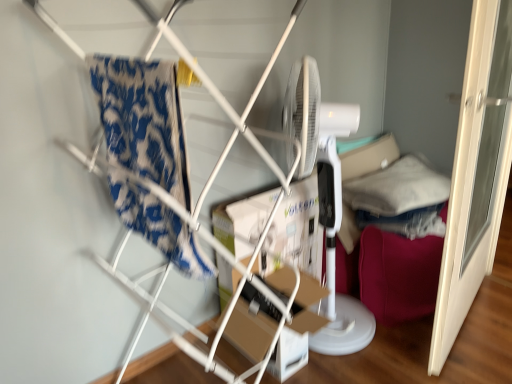
Describe the element at coordinates (143, 119) in the screenshot. I see `blue patterned fabric at left` at that location.

Image resolution: width=512 pixels, height=384 pixels. What do you see at coordinates (326, 197) in the screenshot? I see `white plastic mechanical fan at right` at bounding box center [326, 197].

The height and width of the screenshot is (384, 512). What do you see at coordinates (397, 274) in the screenshot? I see `velvet pink bean bag chair at right` at bounding box center [397, 274].

This screenshot has height=384, width=512. What do you see at coordinates (397, 188) in the screenshot?
I see `soft white pillow at right` at bounding box center [397, 188].

At what (x,y) coordinates should I click in order to perform the action: click on cardboard box at center. Please return your answer as a coordinate pair (x, y). Image resolution: width=512 pixels, height=384 pixels. Looking at the image, I should click on (295, 319).

Can you confirm if soft white pillow at right is wider than blue patterned fabric at left?

In fact, soft white pillow at right might be narrower than blue patterned fabric at left.

Is soft white pillow at right bigger than blue patterned fabric at left?

Yes.

Measure the distance between soft white pillow at right and blue patterned fabric at left.

A distance of 3.87 feet exists between soft white pillow at right and blue patterned fabric at left.

Is soft white pillow at right facing towards blue patterned fabric at left?

No, soft white pillow at right does not turn towards blue patterned fabric at left.

Can you tell me how much velvet pink bean bag chair at right and white plastic mechanical fan at right differ in facing direction?

The angle between the facing direction of velvet pink bean bag chair at right and the facing direction of white plastic mechanical fan at right is 37.1 degrees.

Which object is closer to the camera, velvet pink bean bag chair at right or white plastic mechanical fan at right?

white plastic mechanical fan at right is closer to the camera.

From the image's perspective, would you say velvet pink bean bag chair at right is shown under white plastic mechanical fan at right?

Correct, velvet pink bean bag chair at right appears lower than white plastic mechanical fan at right in the image.

Considering the sizes of objects velvet pink bean bag chair at right and white plastic mechanical fan at right in the image provided, who is smaller, velvet pink bean bag chair at right or white plastic mechanical fan at right?

Smaller between the two is velvet pink bean bag chair at right.

From the image's perspective, is blue patterned fabric at left below white plastic mechanical fan at right?

No.

Between blue patterned fabric at left and white plastic mechanical fan at right, which one has less height?

blue patterned fabric at left is shorter.

Which object is thinner, blue patterned fabric at left or white plastic mechanical fan at right?

Thinner between the two is white plastic mechanical fan at right.

From a real-world perspective, is blue patterned fabric at left positioned above or below white plastic mechanical fan at right?

From a real-world perspective, blue patterned fabric at left is physically above white plastic mechanical fan at right.

From the image's perspective, relative to cardboard box at center, is white plastic mechanical fan at right above or below?

white plastic mechanical fan at right is above cardboard box at center.

From a real-world perspective, is white plastic mechanical fan at right physically below cardboard box at center?

No.

Looking at this image, does white plastic mechanical fan at right touch cardboard box at center?

No, white plastic mechanical fan at right is not touching cardboard box at center.

Considering the sizes of objects white plastic mechanical fan at right and cardboard box at center in the image provided, who is wider, white plastic mechanical fan at right or cardboard box at center?

white plastic mechanical fan at right is wider.

In terms of height, does velvet pink bean bag chair at right look taller or shorter compared to blue patterned fabric at left?

In the image, velvet pink bean bag chair at right appears to be shorter than blue patterned fabric at left.

From the image's perspective, between velvet pink bean bag chair at right and blue patterned fabric at left, who is located below?

velvet pink bean bag chair at right is shown below in the image.

Are velvet pink bean bag chair at right and blue patterned fabric at left beside each other?

velvet pink bean bag chair at right and blue patterned fabric at left are not in contact.

Is soft white pillow at right at the back of white plastic mechanical fan at right?

No.

From a real-world perspective, which is physically below, white plastic mechanical fan at right or soft white pillow at right?

soft white pillow at right.

In the image, is white plastic mechanical fan at right on the left side or the right side of soft white pillow at right?

Clearly, white plastic mechanical fan at right is on the left of soft white pillow at right in the image.

Measure the distance between white plastic mechanical fan at right and soft white pillow at right.

They are 17.99 inches apart.

From a real-world perspective, is soft white pillow at right under cardboard box at center?

Actually, soft white pillow at right is physically above cardboard box at center in the real world.

Identify the location of pillow on the right side of cardboard box at center. The width and height of the screenshot is (512, 384). (397, 188).

Considering the positions of objects soft white pillow at right and cardboard box at center in the image provided, who is more to the left, soft white pillow at right or cardboard box at center?

Positioned to the left is cardboard box at center.

Between soft white pillow at right and cardboard box at center, which one has smaller width?

With smaller width is cardboard box at center.

Find the location of a particular element. beach towel in front of the soft white pillow at right is located at coordinates (143, 119).

Identify the location of mechanical fan above the velvet pink bean bag chair at right (from the image's perspective). Image resolution: width=512 pixels, height=384 pixels. (326, 197).

Which object lies nearer to the anchor point soft white pillow at right, white plastic mechanical fan at right or blue patterned fabric at left?

white plastic mechanical fan at right is positioned closer to the anchor soft white pillow at right.

Estimate the real-world distances between objects in this image. Which object is closer to velvet pink bean bag chair at right, blue patterned fabric at left or white plastic mechanical fan at right?

The object closer to velvet pink bean bag chair at right is white plastic mechanical fan at right.

Consider the image. Looking at the image, which one is located further to cardboard box at center, blue patterned fabric at left or white plastic mechanical fan at right?

Based on the image, blue patterned fabric at left appears to be further to cardboard box at center.

Which object lies nearer to the anchor point white plastic mechanical fan at right, cardboard box at center or velvet pink bean bag chair at right?

velvet pink bean bag chair at right is positioned closer to the anchor white plastic mechanical fan at right.

Looking at this image, which object lies further to the anchor point soft white pillow at right, cardboard box at center or white plastic mechanical fan at right?

The object further to soft white pillow at right is cardboard box at center.

Estimate the real-world distances between objects in this image. Which object is closer to blue patterned fabric at left, soft white pillow at right or cardboard box at center?

Based on the image, cardboard box at center appears to be nearer to blue patterned fabric at left.

From the picture: From the image, which object appears to be nearer to velvet pink bean bag chair at right, white plastic mechanical fan at right or soft white pillow at right?

soft white pillow at right lies closer to velvet pink bean bag chair at right than the other object.

Based on their spatial positions, is blue patterned fabric at left or cardboard box at center further from white plastic mechanical fan at right?

Among the two, blue patterned fabric at left is located further to white plastic mechanical fan at right.

What are the coordinates of `pillow between white plastic mechanical fan at right and velvet pink bean bag chair at right` in the screenshot? It's located at (397, 188).

The image size is (512, 384). What are the coordinates of `mechanical fan between blue patterned fabric at left and soft white pillow at right in the horizontal direction` in the screenshot? It's located at (326, 197).

The width and height of the screenshot is (512, 384). What are the coordinates of `cardboard box between blue patterned fabric at left and soft white pillow at right` in the screenshot? It's located at (295, 319).

Image resolution: width=512 pixels, height=384 pixels. I want to click on mechanical fan between blue patterned fabric at left and cardboard box at center from top to bottom, so click(326, 197).